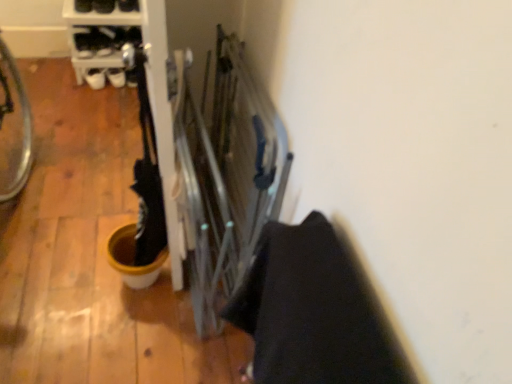
Question: Is black leather shoe at upper center, the second footwear when ordered from left to right, positioned far away from black leather shoe at upper left, which is the 2th footwear from right to left?

Choices:
 (A) no
 (B) yes

Answer: (A)

Question: Is black leather shoe at upper center, the first footwear when ordered from right to left, bigger than black leather shoe at upper left, which is the 2th footwear from right to left?

Choices:
 (A) yes
 (B) no

Answer: (B)

Question: Considering the relative sizes of black leather shoe at upper center, the second footwear when ordered from left to right, and black leather shoe at upper left, which is the 2th footwear from right to left, in the image provided, is black leather shoe at upper center, the second footwear when ordered from left to right, thinner than black leather shoe at upper left, which is the 2th footwear from right to left,?

Choices:
 (A) yes
 (B) no

Answer: (A)

Question: Is black leather shoe at upper center, the first footwear when ordered from right to left, to the left of black leather shoe at upper left, which is counted as the 1th footwear, starting from the left, from the viewer's perspective?

Choices:
 (A) no
 (B) yes

Answer: (A)

Question: From a real-world perspective, is black leather shoe at upper center, the first footwear when ordered from right to left, physically above black leather shoe at upper left, which is counted as the 1th footwear, starting from the left?

Choices:
 (A) yes
 (B) no

Answer: (B)

Question: Is the depth of black leather shoe at upper center, the first footwear when ordered from right to left, less than that of black leather shoe at upper left, which is counted as the 1th footwear, starting from the left?

Choices:
 (A) no
 (B) yes

Answer: (A)

Question: From the image's perspective, is black leather shoe at upper left, which is the 2th footwear from right to left, over black leather shoe at upper center, the second footwear when ordered from left to right?

Choices:
 (A) no
 (B) yes

Answer: (A)

Question: Is black leather shoe at upper left, which is the 2th footwear from right to left, closer to the viewer compared to black leather shoe at upper center, the second footwear when ordered from left to right?

Choices:
 (A) yes
 (B) no

Answer: (A)

Question: Is black leather shoe at upper left, which is counted as the 1th footwear, starting from the left, facing away from black leather shoe at upper center, the second footwear when ordered from left to right?

Choices:
 (A) no
 (B) yes

Answer: (A)

Question: Is black leather shoe at upper left, which is counted as the 1th footwear, starting from the left, bigger than black leather shoe at upper center, the first footwear when ordered from right to left?

Choices:
 (A) yes
 (B) no

Answer: (A)

Question: Considering the relative positions of black leather shoe at upper left, which is the 2th footwear from right to left, and black leather shoe at upper center, the first footwear when ordered from right to left, in the image provided, is black leather shoe at upper left, which is the 2th footwear from right to left, to the right of black leather shoe at upper center, the first footwear when ordered from right to left, from the viewer's perspective?

Choices:
 (A) yes
 (B) no

Answer: (B)

Question: Is black leather shoe at upper left, which is counted as the 1th footwear, starting from the left, shorter than black leather shoe at upper center, the second footwear when ordered from left to right?

Choices:
 (A) no
 (B) yes

Answer: (A)

Question: Considering the relative positions of black leather shoe at upper center, the second footwear when ordered from left to right, and black leather shoe at upper left, which is the 2th footwear from right to left, in the image provided, is black leather shoe at upper center, the second footwear when ordered from left to right, to the left or to the right of black leather shoe at upper left, which is the 2th footwear from right to left,?

Choices:
 (A) right
 (B) left

Answer: (A)